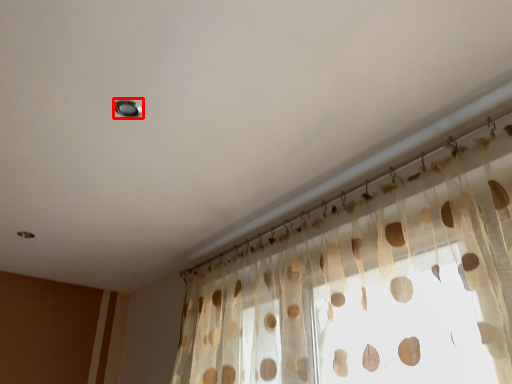
Question: Considering the relative positions of light (annotated by the red box) and curtain in the image provided, where is light (annotated by the red box) located with respect to the staircase?

Choices:
 (A) right
 (B) left

Answer: (B)